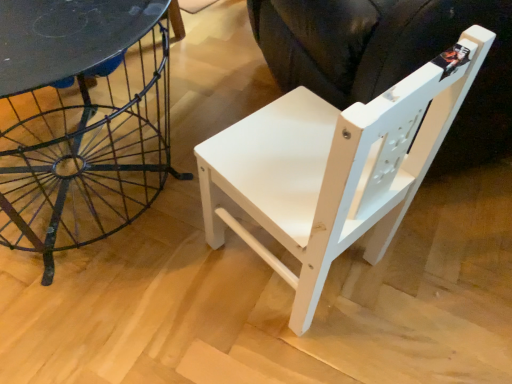
I want to click on vacant point to the right of white matte wood chair at center, so click(x=430, y=279).